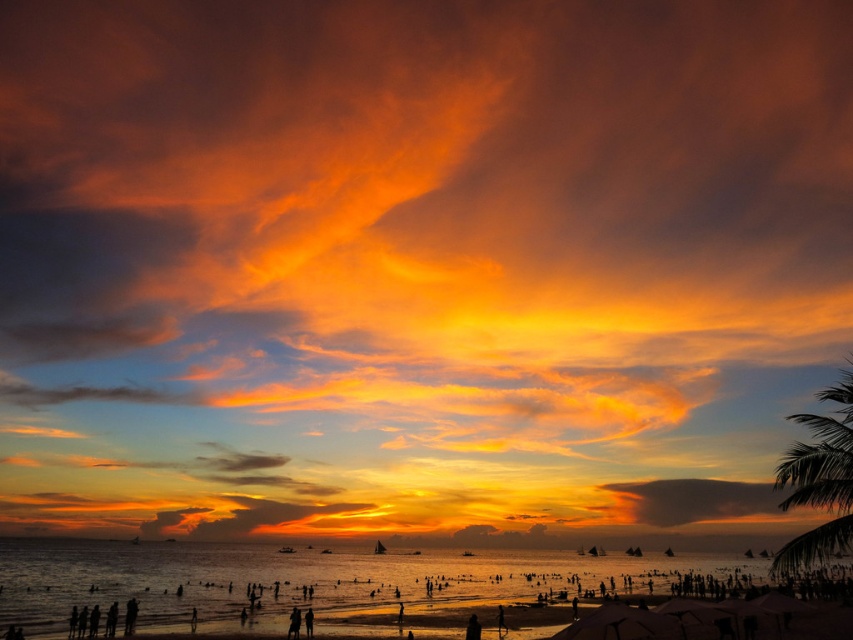
Question: Among these points, which one is farthest from the camera?

Choices:
 (A) pyautogui.click(x=828, y=554)
 (B) pyautogui.click(x=706, y=490)
 (C) pyautogui.click(x=294, y=509)

Answer: (B)

Question: Is translucent golden water at center smaller than green leafy palm tree at right?

Choices:
 (A) yes
 (B) no

Answer: (B)

Question: Which is farther from the translucent orange cloud at center?

Choices:
 (A) green leafy palm tree at right
 (B) matte orange cloud at lower right

Answer: (A)

Question: Is the position of translucent golden water at center less distant than that of green leafy palm tree at right?

Choices:
 (A) yes
 (B) no

Answer: (A)

Question: Does green leafy palm tree at right appear over translucent orange cloud at center?

Choices:
 (A) yes
 (B) no

Answer: (A)

Question: Among these objects, which one is nearest to the camera?

Choices:
 (A) matte orange cloud at lower right
 (B) translucent golden water at center

Answer: (B)